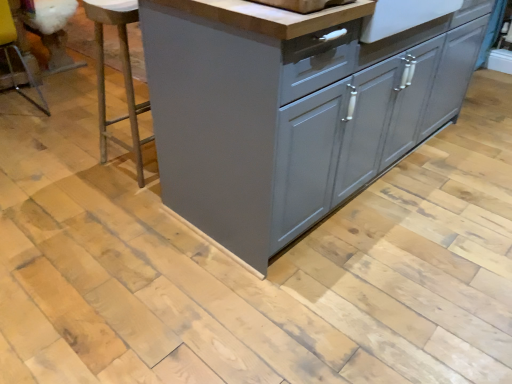
Image resolution: width=512 pixels, height=384 pixels. In order to click on free region under clear plastic bar stool at left, the second bar stool viewed from the right (from a real-world perspective) in this screenshot , I will do `click(22, 111)`.